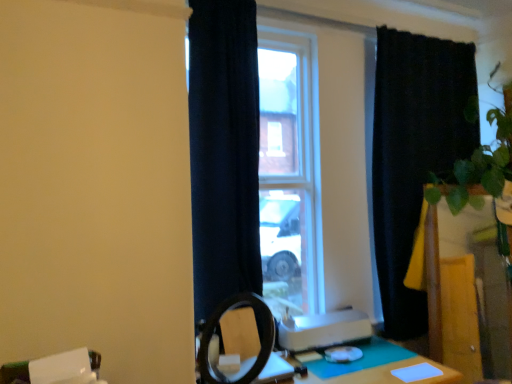
The image size is (512, 384). Find the location of `green felt table at lower right`. green felt table at lower right is located at coordinates (374, 368).

You are a GUI agent. You are given a task and a screenshot of the screen. Output one action in this format:
    pyautogui.click(x=<x>, y=<y>)
    Task: Click on the navy blue curtain at center, which is the 1th curtain in front-to-back order
    The image size is (512, 384).
    Given the screenshot: What is the action you would take?
    pyautogui.click(x=224, y=151)

Find the location of a particular element. The height and width of the screenshot is (384, 512). green matte plant at right is located at coordinates (433, 284).

Locate an element on the screen. The height and width of the screenshot is (384, 512). black velvet curtain at right, placed as the 1th curtain when sorted from right to left is located at coordinates (414, 154).

Identify the location of green felt table at lower right. (374, 368).

Locate an element on the screen. vanity lying below the black velvet curtain at right, positioned as the 2th curtain in front-to-back order (from the image's perspective) is located at coordinates (433, 284).

Does point (411, 54) come farther from viewer compared to point (432, 349)?

That is True.

Which object is more forward, black velvet curtain at right, the second curtain in the left-to-right sequence, or green matte plant at right?

green matte plant at right is more forward.

Is black velvet curtain at right, positioned as the 2th curtain in front-to-back order, bigger than green matte plant at right?

Yes, black velvet curtain at right, positioned as the 2th curtain in front-to-back order, is bigger than green matte plant at right.

Locate an element on the screen. curtain that is the 1st one above the green matte plant at right (from a real-world perspective) is located at coordinates (414, 154).

Considering the relative positions of green matte plant at right and black velvet curtain at right, placed as the 1th curtain when sorted from right to left, in the image provided, is green matte plant at right to the right of black velvet curtain at right, placed as the 1th curtain when sorted from right to left, from the viewer's perspective?

Yes.

Based on the photo, is black velvet curtain at right, which ranks as the first curtain in back-to-front order, in contact with navy blue curtain at center, the first curtain when ordered from left to right?

black velvet curtain at right, which ranks as the first curtain in back-to-front order, and navy blue curtain at center, the first curtain when ordered from left to right, are not in contact.

From a real-world perspective, is black velvet curtain at right, placed as the 1th curtain when sorted from right to left, positioned above or below navy blue curtain at center, positioned as the 2th curtain in right-to-left order?

black velvet curtain at right, placed as the 1th curtain when sorted from right to left, is situated lower than navy blue curtain at center, positioned as the 2th curtain in right-to-left order, in the real world.

From the image's perspective, would you say black velvet curtain at right, placed as the 1th curtain when sorted from right to left, is shown under navy blue curtain at center, the second curtain positioned from the back?

No, from the image's perspective, black velvet curtain at right, placed as the 1th curtain when sorted from right to left, is not below navy blue curtain at center, the second curtain positioned from the back.

Is black velvet curtain at right, which ranks as the first curtain in back-to-front order, oriented towards navy blue curtain at center, the second curtain positioned from the back?

No.

Based on the photo, are green matte plant at right and navy blue curtain at center, the second curtain positioned from the back, beside each other?

No, green matte plant at right is not making contact with navy blue curtain at center, the second curtain positioned from the back.

Does green matte plant at right turn towards navy blue curtain at center, the first curtain when ordered from left to right?

No, green matte plant at right is not aimed at navy blue curtain at center, the first curtain when ordered from left to right.

From a real-world perspective, between green matte plant at right and navy blue curtain at center, positioned as the 2th curtain in right-to-left order, who is vertically higher?

navy blue curtain at center, positioned as the 2th curtain in right-to-left order.

Can you confirm if green matte plant at right is positioned to the left of navy blue curtain at center, the second curtain positioned from the back?

No.

From the image's perspective, would you say green matte plant at right is positioned over green felt table at lower right?

Indeed, from the image's perspective, green matte plant at right is shown above green felt table at lower right.

Between green matte plant at right and green felt table at lower right, which one appears on the left side from the viewer's perspective?

Positioned to the left is green felt table at lower right.

In terms of height, does green matte plant at right look taller or shorter compared to green felt table at lower right?

In the image, green matte plant at right appears to be taller than green felt table at lower right.

Is green felt table at lower right smaller than black velvet curtain at right, which ranks as the first curtain in back-to-front order?

Yes.

Considering the points (400, 353) and (384, 88), which point is in front, point (400, 353) or point (384, 88)?

The point (400, 353) is more forward.

Are green felt table at lower right and black velvet curtain at right, which ranks as the first curtain in back-to-front order, located far from each other?

Yes.

Considering the relative positions of green felt table at lower right and black velvet curtain at right, the second curtain in the left-to-right sequence, in the image provided, is green felt table at lower right to the left of black velvet curtain at right, the second curtain in the left-to-right sequence, from the viewer's perspective?

Indeed, green felt table at lower right is positioned on the left side of black velvet curtain at right, the second curtain in the left-to-right sequence.

Is navy blue curtain at center, the first curtain when ordered from left to right, wider or thinner than black velvet curtain at right, which ranks as the first curtain in back-to-front order?

navy blue curtain at center, the first curtain when ordered from left to right, is wider than black velvet curtain at right, which ranks as the first curtain in back-to-front order.

From a real-world perspective, relative to black velvet curtain at right, which ranks as the first curtain in back-to-front order, is navy blue curtain at center, which is the 1th curtain in front-to-back order, vertically above or below?

navy blue curtain at center, which is the 1th curtain in front-to-back order, is situated higher than black velvet curtain at right, which ranks as the first curtain in back-to-front order, in the real world.

Can you confirm if navy blue curtain at center, positioned as the 2th curtain in right-to-left order, is shorter than black velvet curtain at right, the second curtain in the left-to-right sequence?

Correct, navy blue curtain at center, positioned as the 2th curtain in right-to-left order, is not as tall as black velvet curtain at right, the second curtain in the left-to-right sequence.

Looking at the image, does navy blue curtain at center, the second curtain positioned from the back, seem bigger or smaller compared to black velvet curtain at right, placed as the 1th curtain when sorted from right to left?

navy blue curtain at center, the second curtain positioned from the back, is smaller than black velvet curtain at right, placed as the 1th curtain when sorted from right to left.

The height and width of the screenshot is (384, 512). Find the location of `vanity that appears on the right of black velvet curtain at right, the second curtain in the left-to-right sequence`. vanity that appears on the right of black velvet curtain at right, the second curtain in the left-to-right sequence is located at coordinates (433, 284).

This screenshot has height=384, width=512. What are the coordinates of `the 1st curtain to the left of the green matte plant at right, counting from the anchor's position` in the screenshot? It's located at (414, 154).

Based on their spatial positions, is navy blue curtain at center, which is the 1th curtain in front-to-back order, or black velvet curtain at right, the second curtain in the left-to-right sequence, closer to green matte plant at right?

black velvet curtain at right, the second curtain in the left-to-right sequence, is closer to green matte plant at right.

Based on their spatial positions, is green matte plant at right or green felt table at lower right further from black velvet curtain at right, which ranks as the first curtain in back-to-front order?

The object further to black velvet curtain at right, which ranks as the first curtain in back-to-front order, is green felt table at lower right.

Which object lies further to the anchor point green matte plant at right, black velvet curtain at right, positioned as the 2th curtain in front-to-back order, or green felt table at lower right?

green felt table at lower right.

When comparing their distances from navy blue curtain at center, positioned as the 2th curtain in right-to-left order, does black velvet curtain at right, positioned as the 2th curtain in front-to-back order, or green felt table at lower right seem closer?

green felt table at lower right.

Looking at the image, which one is located closer to black velvet curtain at right, positioned as the 2th curtain in front-to-back order, green felt table at lower right or green matte plant at right?

green matte plant at right is positioned closer to the anchor black velvet curtain at right, positioned as the 2th curtain in front-to-back order.

From the image, which object appears to be nearer to green felt table at lower right, green matte plant at right or navy blue curtain at center, which is the 1th curtain in front-to-back order?

green matte plant at right is positioned closer to the anchor green felt table at lower right.

Looking at the image, which one is located closer to green felt table at lower right, black velvet curtain at right, which ranks as the first curtain in back-to-front order, or green matte plant at right?

green matte plant at right is closer to green felt table at lower right.

Which object lies nearer to the anchor point green felt table at lower right, navy blue curtain at center, the second curtain positioned from the back, or black velvet curtain at right, which ranks as the first curtain in back-to-front order?

navy blue curtain at center, the second curtain positioned from the back, is closer to green felt table at lower right.

At what (x,y) coordinates should I click in order to perform the action: click on vanity between black velvet curtain at right, which ranks as the first curtain in back-to-front order, and green felt table at lower right vertically. Please return your answer as a coordinate pair (x, y). This screenshot has height=384, width=512. Looking at the image, I should click on pos(433,284).

The height and width of the screenshot is (384, 512). Find the location of `curtain situated between navy blue curtain at center, the first curtain when ordered from left to right, and green matte plant at right from left to right`. curtain situated between navy blue curtain at center, the first curtain when ordered from left to right, and green matte plant at right from left to right is located at coordinates (414, 154).

The image size is (512, 384). I want to click on table between navy blue curtain at center, positioned as the 2th curtain in right-to-left order, and green matte plant at right, in the horizontal direction, so click(374, 368).

Where is `table between navy blue curtain at center, the first curtain when ordered from left to right, and black velvet curtain at right, which ranks as the first curtain in back-to-front order`? The height and width of the screenshot is (384, 512). table between navy blue curtain at center, the first curtain when ordered from left to right, and black velvet curtain at right, which ranks as the first curtain in back-to-front order is located at coordinates (374, 368).